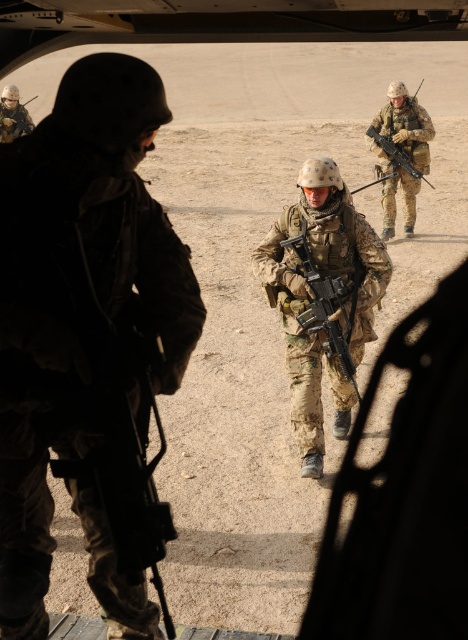
Question: Which object is positioned closest to the matte black helmet at upper left?

Choices:
 (A) camouflage fabric uniform at center
 (B) camouflage-patterned rifle at center

Answer: (A)

Question: Which object appears closest to the camera in this image?

Choices:
 (A) matte black rifle at center
 (B) matte black helmet at upper left
 (C) camouflage uniform at center

Answer: (C)

Question: Is camouflage uniform at center above camouflage fabric rifle at center?

Choices:
 (A) yes
 (B) no

Answer: (B)

Question: Considering the real-world distances, which object is closest to the camouflage fabric uniform at center?

Choices:
 (A) matte black helmet at upper left
 (B) camouflage fabric rifle at center

Answer: (B)

Question: Observing the image, what is the correct spatial positioning of camouflage uniform at center in reference to camouflage fabric uniform at center?

Choices:
 (A) above
 (B) below

Answer: (B)

Question: Can you confirm if camouflage uniform at center is positioned to the right of matte black rifle at center?

Choices:
 (A) yes
 (B) no

Answer: (B)